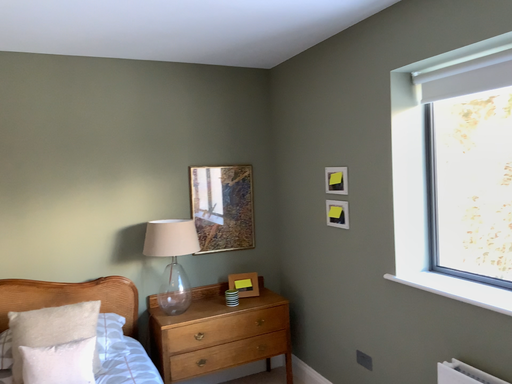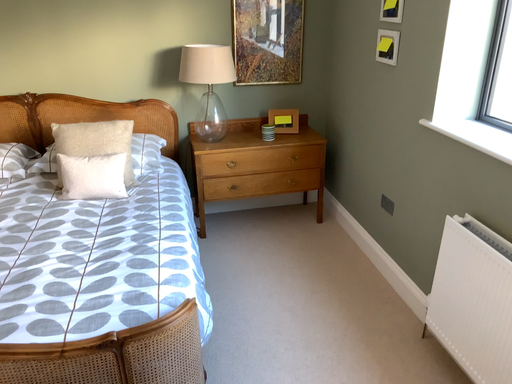
Question: How did the camera likely rotate when shooting the video?

Choices:
 (A) rotated downward
 (B) rotated upward

Answer: (A)